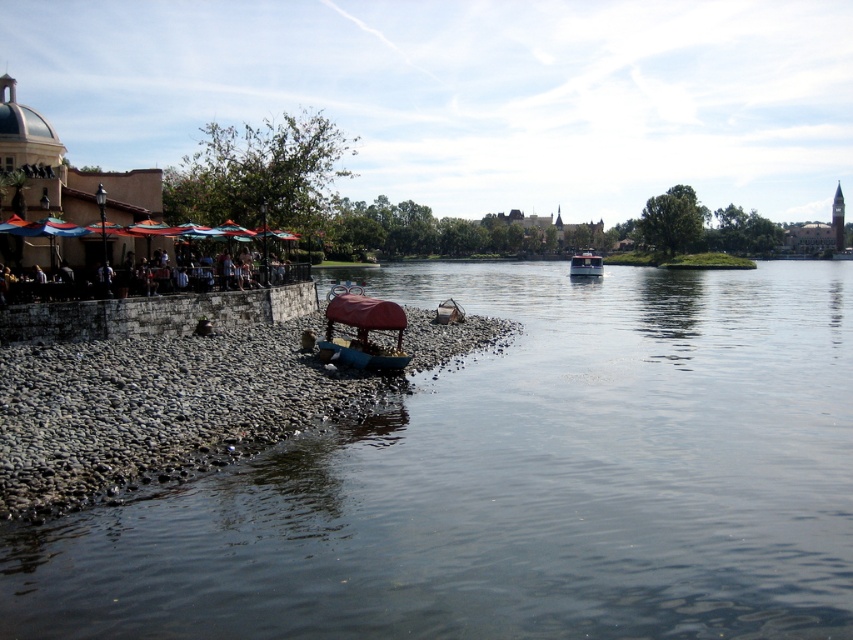
Is smooth stone river at lower left to the right of gray gravel at lower left from the viewer's perspective?

Correct, you'll find smooth stone river at lower left to the right of gray gravel at lower left.

Is point (572, 592) farther from camera compared to point (347, 388)?

No.

Where is `smooth stone river at lower left`? Image resolution: width=853 pixels, height=640 pixels. smooth stone river at lower left is located at coordinates (515, 483).

Based on the photo, which of these two, gray gravel at lower left or dark brown wooden bench at left, stands shorter?

dark brown wooden bench at left

Is gray gravel at lower left to the right of dark brown wooden bench at left from the viewer's perspective?

Indeed, gray gravel at lower left is positioned on the right side of dark brown wooden bench at left.

Find the location of a particular element. Image resolution: width=853 pixels, height=640 pixels. gray gravel at lower left is located at coordinates (160, 410).

Is gray gravel at lower left smaller than metallic red boat at center?

Indeed, gray gravel at lower left has a smaller size compared to metallic red boat at center.

Is gray gravel at lower left positioned before metallic red boat at center?

Yes, it is in front of metallic red boat at center.

At what (x,y) coordinates should I click in order to perform the action: click on gray gravel at lower left. Please return your answer as a coordinate pair (x, y). The image size is (853, 640). Looking at the image, I should click on (160, 410).